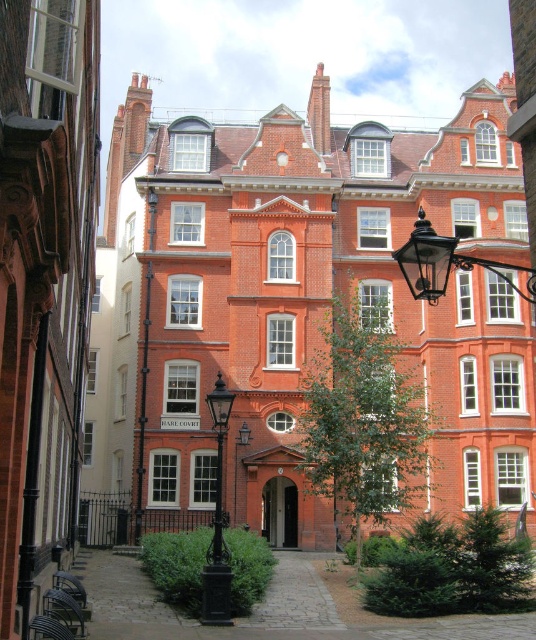
Question: Does black wrought iron streetlight at upper right appear on the right side of black wrought iron lamp post at center?

Choices:
 (A) no
 (B) yes

Answer: (B)

Question: Which point is closer to the camera taking this photo?

Choices:
 (A) (436, 246)
 (B) (220, 605)

Answer: (A)

Question: Is black wrought iron streetlight at upper right smaller than black wrought iron lamp post at center?

Choices:
 (A) yes
 (B) no

Answer: (B)

Question: Does black wrought iron streetlight at upper right have a greater width compared to black wrought iron lamp post at center?

Choices:
 (A) no
 (B) yes

Answer: (B)

Question: Which point is closer to the camera taking this photo?

Choices:
 (A) (206, 582)
 (B) (413, 291)

Answer: (B)